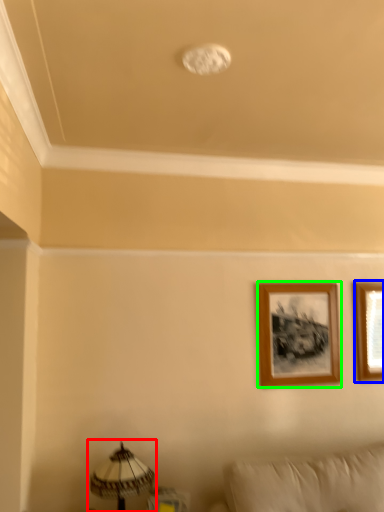
Question: Which is nearer to the table lamp (highlighted by a red box)? picture frame (highlighted by a blue box) or picture frame (highlighted by a green box).

Choices:
 (A) picture frame
 (B) picture frame

Answer: (B)